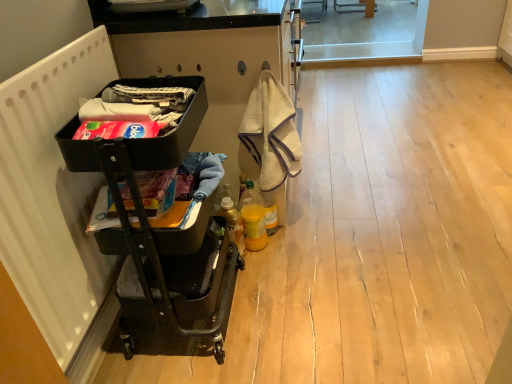
Question: Is beige towel at center aimed at translucent plastic bottle at lower center, which is the 1th bottle from left to right?

Choices:
 (A) no
 (B) yes

Answer: (A)

Question: Considering the relative sizes of beige towel at center and translucent plastic bottle at lower center, which is the 1th bottle from left to right, in the image provided, is beige towel at center bigger than translucent plastic bottle at lower center, which is the 1th bottle from left to right,?

Choices:
 (A) no
 (B) yes

Answer: (B)

Question: From the image's perspective, is beige towel at center beneath translucent plastic bottle at lower center, which is the 1th bottle from left to right?

Choices:
 (A) yes
 (B) no

Answer: (B)

Question: Considering the relative sizes of beige towel at center and translucent plastic bottle at lower center, placed as the second bottle when sorted from right to left, in the image provided, is beige towel at center taller than translucent plastic bottle at lower center, placed as the second bottle when sorted from right to left,?

Choices:
 (A) yes
 (B) no

Answer: (A)

Question: Does beige towel at center contain translucent plastic bottle at lower center, which is the 1th bottle from left to right?

Choices:
 (A) no
 (B) yes

Answer: (A)

Question: Does point (265, 155) appear closer or farther from the camera than point (276, 221)?

Choices:
 (A) farther
 (B) closer

Answer: (B)

Question: Based on their sizes in the image, would you say beige towel at center is bigger or smaller than translucent plastic bottle at center, the 1th bottle from the right?

Choices:
 (A) small
 (B) big

Answer: (B)

Question: In terms of width, does beige towel at center look wider or thinner when compared to translucent plastic bottle at center, the 2th bottle viewed from the left?

Choices:
 (A) thin
 (B) wide

Answer: (B)

Question: Is beige towel at center situated inside translucent plastic bottle at center, the 1th bottle from the right, or outside?

Choices:
 (A) outside
 (B) inside

Answer: (A)

Question: Considering the relative positions of white matte radiator at left and matte black laundry basket at left, marked as the 2th laundry in a bottom-to-top arrangement, in the image provided, is white matte radiator at left to the left or to the right of matte black laundry basket at left, marked as the 2th laundry in a bottom-to-top arrangement,?

Choices:
 (A) right
 (B) left

Answer: (B)

Question: Is white matte radiator at left taller or shorter than matte black laundry basket at left, which appears as the 1th laundry when viewed from the top?

Choices:
 (A) short
 (B) tall

Answer: (B)

Question: Does point (67, 241) appear closer or farther from the camera than point (120, 120)?

Choices:
 (A) closer
 (B) farther

Answer: (B)

Question: From the image's perspective, relative to matte black laundry basket at left, which appears as the 1th laundry when viewed from the top, is white matte radiator at left above or below?

Choices:
 (A) above
 (B) below

Answer: (B)

Question: From a real-world perspective, is matte black laundry basket at left, placed as the 1th laundry when sorted from bottom to top, physically located above or below matte black laundry basket at left, which appears as the 1th laundry when viewed from the top?

Choices:
 (A) below
 (B) above

Answer: (A)

Question: In the image, is matte black laundry basket at left, placed as the 1th laundry when sorted from bottom to top, positioned in front of or behind matte black laundry basket at left, marked as the 2th laundry in a bottom-to-top arrangement?

Choices:
 (A) behind
 (B) front

Answer: (A)